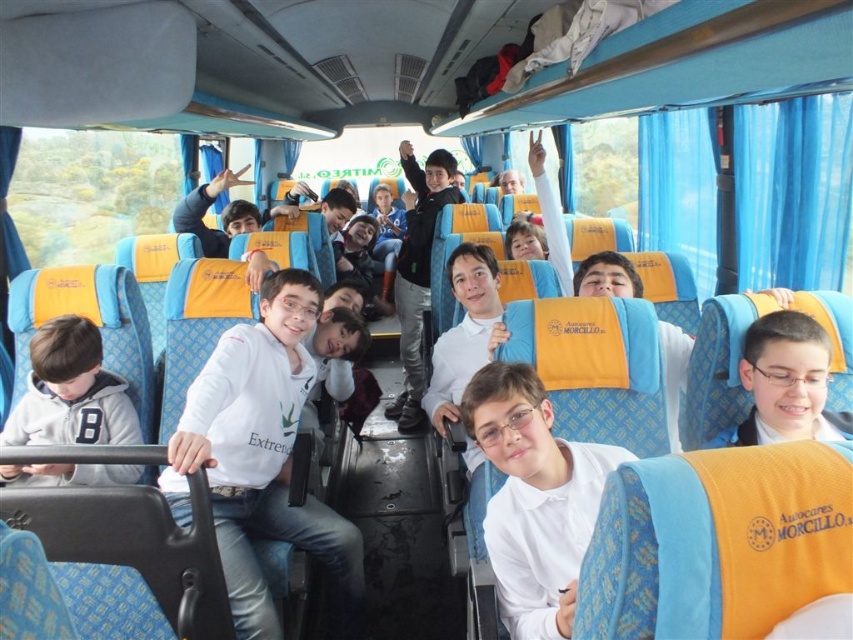
Question: Is white glossy shirt at center smaller than matte white shirt at center?

Choices:
 (A) no
 (B) yes

Answer: (A)

Question: Does matte white shirt at center have a smaller size compared to dark blue jeans at center?

Choices:
 (A) yes
 (B) no

Answer: (A)

Question: Which of the following is the closest to the observer?

Choices:
 (A) (786, 346)
 (B) (270, 440)

Answer: (A)

Question: Which point is farther from the camera taking this photo?

Choices:
 (A) (566, 582)
 (B) (57, 413)
 (C) (805, 428)

Answer: (B)

Question: Estimate the real-world distances between objects in this image. Which object is farther from the gray fleece jacket at lower left?

Choices:
 (A) white glossy shirt at center
 (B) matte white shirt at center

Answer: (B)

Question: Is white matte shirt at center wider than dark blue jeans at center?

Choices:
 (A) no
 (B) yes

Answer: (B)